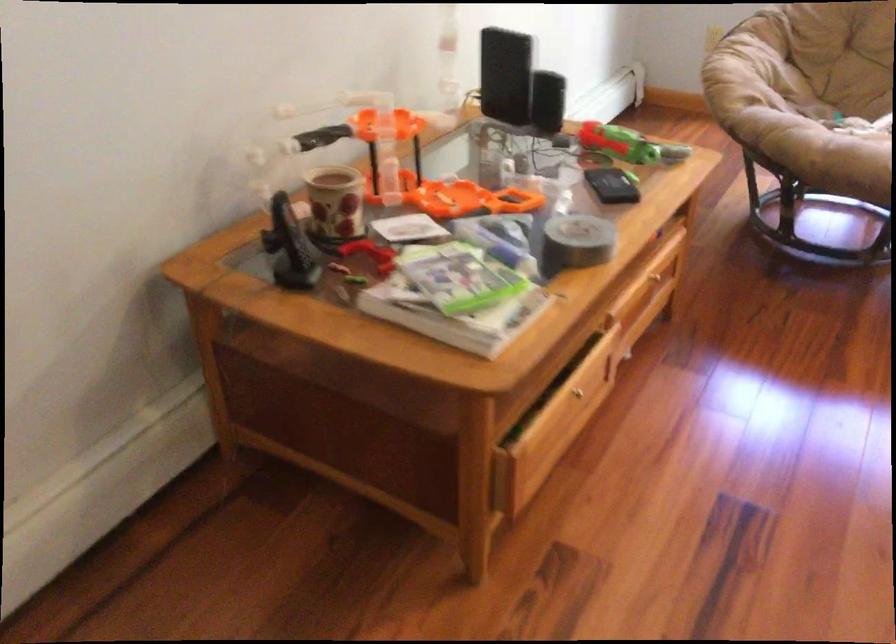
Where is `orange plastic handle`? The width and height of the screenshot is (896, 644). orange plastic handle is located at coordinates 470,199.